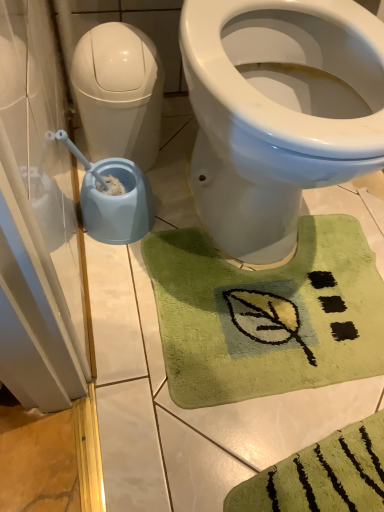
Question: Is point (44, 297) closer or farther from the camera than point (291, 164)?

Choices:
 (A) closer
 (B) farther

Answer: (A)

Question: From a real-world perspective, is transparent plastic screen door at left positioned above or below blue plastic bidet at left?

Choices:
 (A) below
 (B) above

Answer: (A)

Question: Which object is the closest to the blue plastic bidet at left?

Choices:
 (A) green plush bath mat at lower center
 (B) white glossy water tank at left
 (C) transparent plastic screen door at left

Answer: (A)

Question: Based on their relative distances, which object is farther from the blue plastic bidet at left?

Choices:
 (A) transparent plastic screen door at left
 (B) green plush bath mat at lower center
 (C) white glossy water tank at left

Answer: (A)